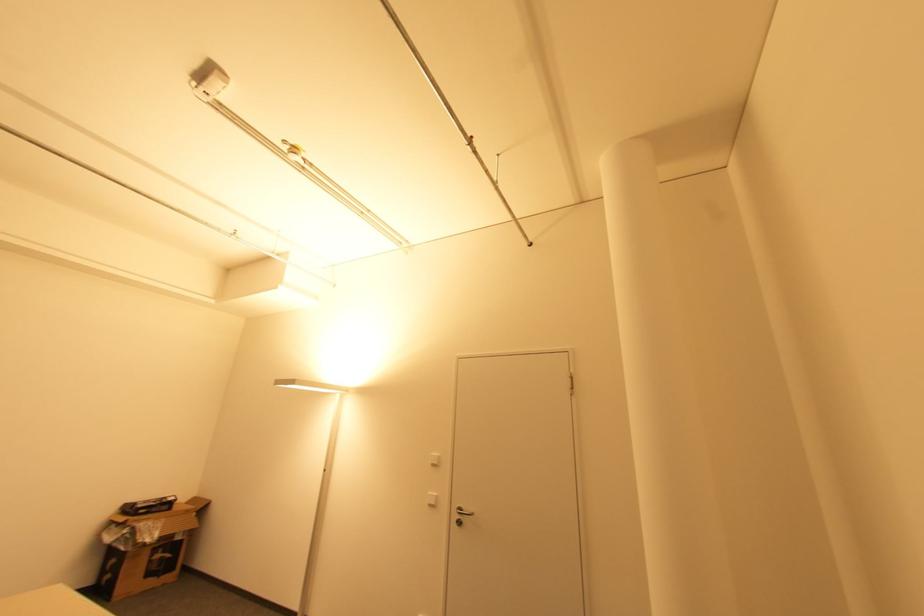
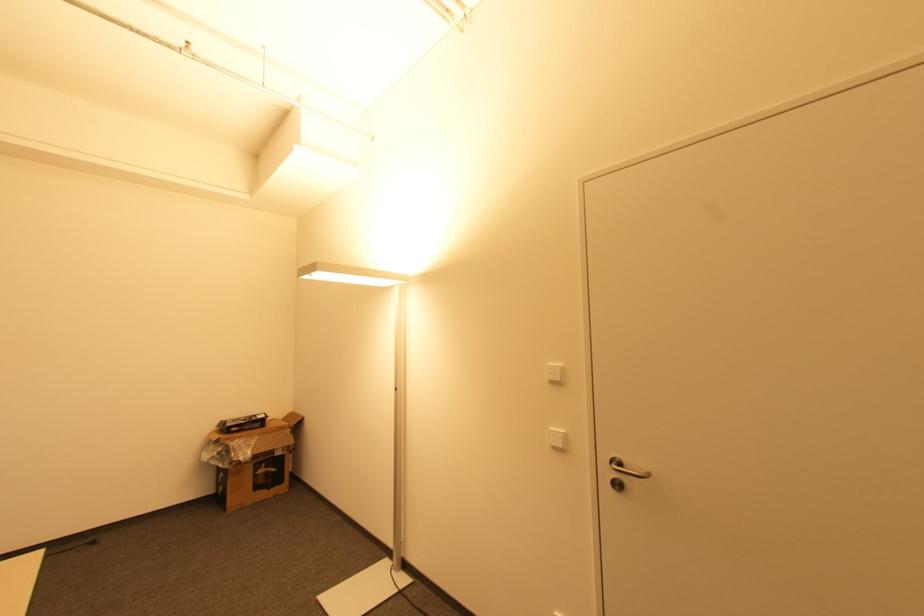
The point at [435,466] is marked in the first image. Where is the corresponding point in the second image?

(554, 383)